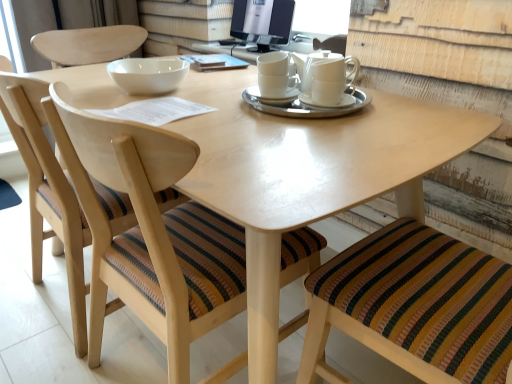
Question: Relative to wooden chair with striped cushion at lower left, the 1th chair in the left-to-right sequence, is white glossy bowl at upper center in front or behind?

Choices:
 (A) front
 (B) behind

Answer: (B)

Question: Based on their sizes in the image, would you say white glossy bowl at upper center is bigger or smaller than wooden chair with striped cushion at lower left, the 1th chair in the left-to-right sequence?

Choices:
 (A) small
 (B) big

Answer: (A)

Question: Based on their relative distances, which object is nearer to the white ceramic saucer at center, arranged as the first saucer when viewed from the left?

Choices:
 (A) white glossy bowl at upper center
 (B) wooden chair with striped cushion at center, the 2th chair from the right
 (C) white ceramic saucer at center, marked as the 2th saucer in a left-to-right arrangement
 (D) wooden chair with striped cushion at lower left, the 1th chair in the left-to-right sequence
 (E) white glossy cup at center

Answer: (E)

Question: Estimate the real-world distances between objects in this image. Which object is farther from the white ceramic saucer at center, arranged as the first saucer when viewed from the left?

Choices:
 (A) wooden chair with striped cushion at lower left, the 1th chair in the left-to-right sequence
 (B) white ceramic saucer at center, the 3th saucer from the left
 (C) matte wood table at center
 (D) white glossy bowl at upper center
 (E) white ceramic saucer at center, marked as the 2th saucer in a left-to-right arrangement

Answer: (A)